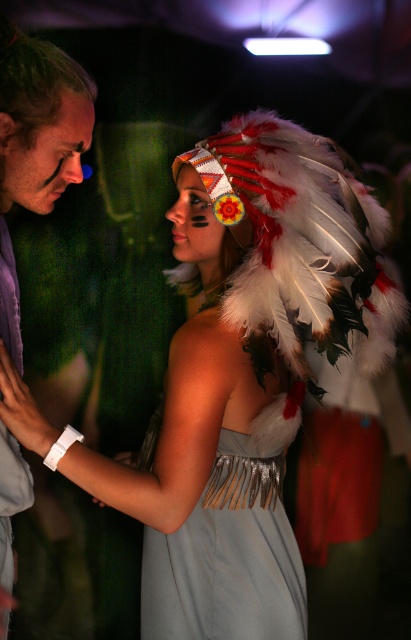
Who is taller, satin silver dress at center or matte purple shirt at left?

matte purple shirt at left

Which is behind, point (191, 515) or point (43, 61)?

The point (191, 515) is more distant.

What do you see at coordinates (228, 557) in the screenshot?
I see `satin silver dress at center` at bounding box center [228, 557].

You are a GUI agent. You are given a task and a screenshot of the screen. Output one action in this format:
    pyautogui.click(x=<x>, y=<y>)
    Task: Click on the satin silver dress at center
    This screenshot has height=640, width=411.
    Given the screenshot: What is the action you would take?
    pyautogui.click(x=228, y=557)

Does white feather headdress at upper center have a larger size compared to matte purple shirt at left?

Yes, white feather headdress at upper center is bigger than matte purple shirt at left.

Which of these two, white feather headdress at upper center or matte purple shirt at left, stands taller?

matte purple shirt at left

This screenshot has width=411, height=640. Describe the element at coordinates (298, 243) in the screenshot. I see `white feather headdress at upper center` at that location.

Identify the location of white feather headdress at upper center. This screenshot has width=411, height=640. (298, 243).

Is white feather headdress at upper center behind satin silver dress at center?

No, it is not.

Can you confirm if white feather headdress at upper center is shorter than satin silver dress at center?

Incorrect, white feather headdress at upper center's height does not fall short of satin silver dress at center's.

Identify the location of white feather headdress at upper center. The width and height of the screenshot is (411, 640). (298, 243).